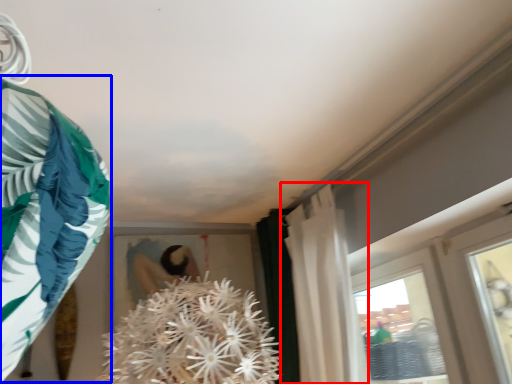
Question: Among these objects, which one is nearest to the camera, curtain (highlighted by a red box) or clothing (highlighted by a blue box)?

Choices:
 (A) curtain
 (B) clothing

Answer: (B)